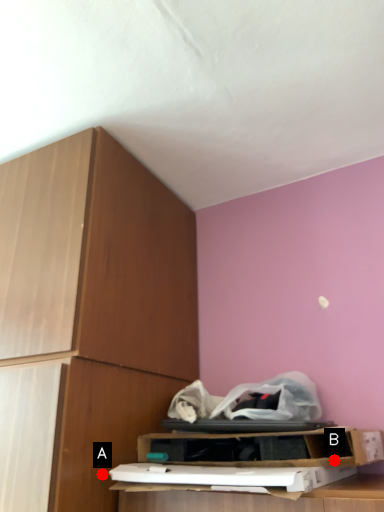
Question: Two points are circled on the image, labeled by A and B beside each circle. Which point is closer to the camera taking this photo?

Choices:
 (A) A is closer
 (B) B is closer

Answer: (B)